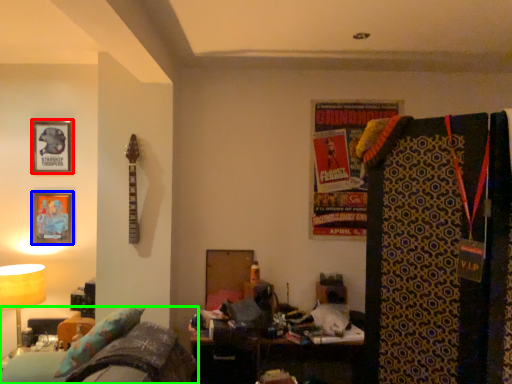
Question: Estimate the real-world distances between objects in this image. Which object is farther from picture frame (highlighted by a red box), picture frame (highlighted by a blue box) or furniture (highlighted by a green box)?

Choices:
 (A) picture frame
 (B) furniture

Answer: (B)